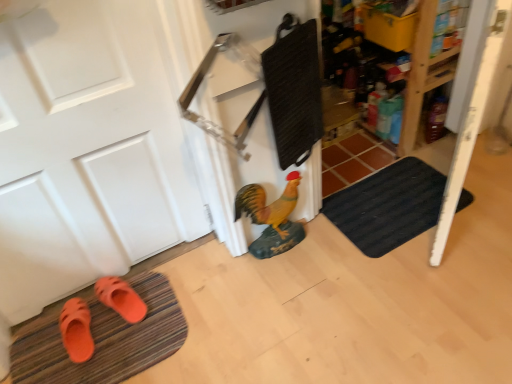
Image resolution: width=512 pixels, height=384 pixels. In order to click on vacant space to the right of shiny yellow chicken at center in this screenshot , I will do `click(322, 249)`.